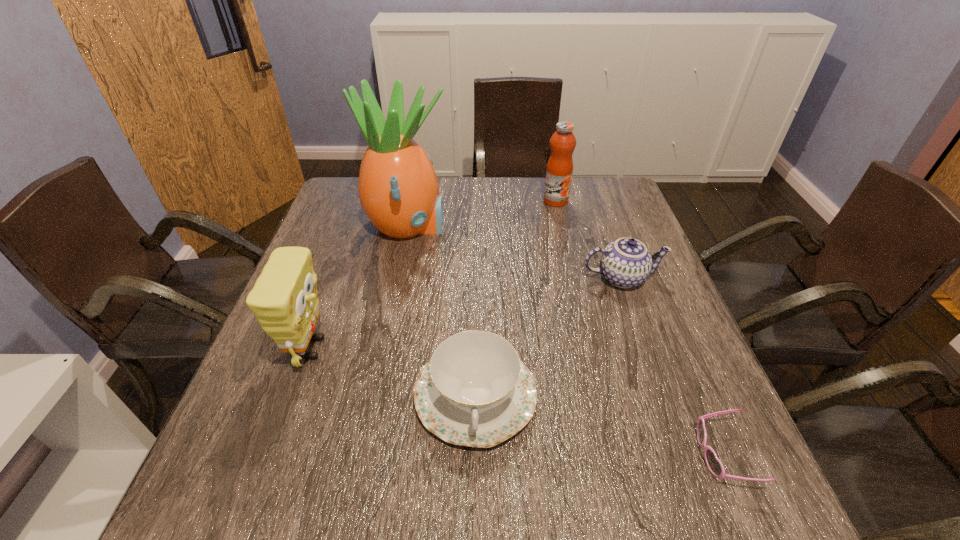
Choose which object is the fourth nearest neighbor to the right chinaware. Please provide its 2D coordinates. Your answer should be formatted as a tuple, i.e. [(x, y)], where the tuple contains the x and y coordinates of a point satisfying the conditions above.

[(398, 189)]

The height and width of the screenshot is (540, 960). I want to click on blank area in the image that satisfies the following two spatial constraints: 1. on the front label of the fruit juice; 2. at the entrance of the tallest object, so click(562, 228).